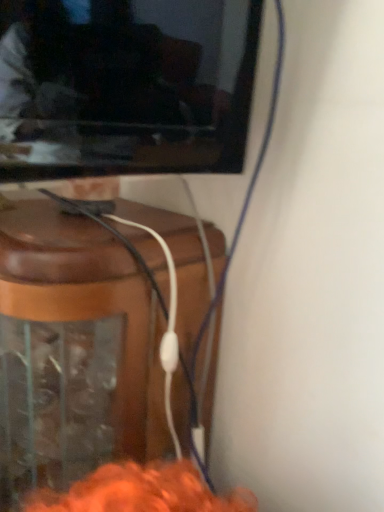
Question: Should I look upward or downward to see brown wood speaker at lower left?

Choices:
 (A) up
 (B) down

Answer: (B)